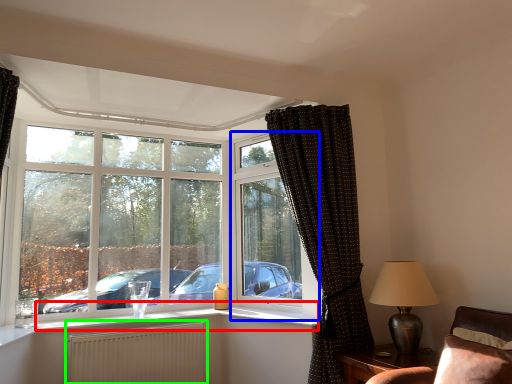
Question: Which is farther away from window sill (highlighted by a red box)? window frame (highlighted by a blue box) or radiator (highlighted by a green box)?

Choices:
 (A) window frame
 (B) radiator

Answer: (A)